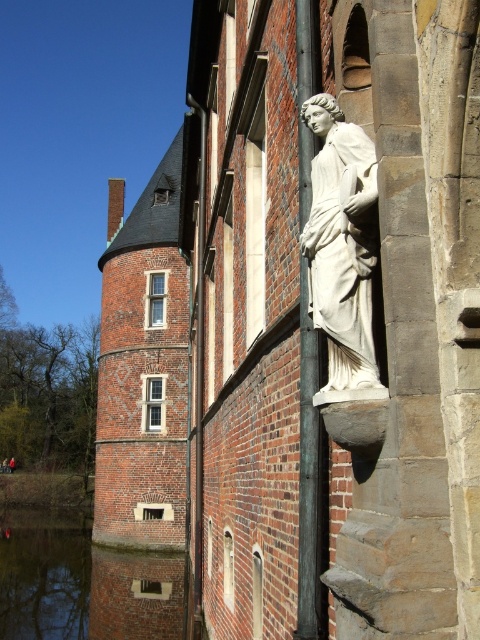
Question: Does white marble statue at upper right have a lesser width compared to smooth gray pole at center?

Choices:
 (A) yes
 (B) no

Answer: (B)

Question: Can you confirm if white marble statue at upper right is bigger than smooth gray pole at center?

Choices:
 (A) no
 (B) yes

Answer: (A)

Question: Which object is closer to the camera taking this photo?

Choices:
 (A) smooth gray pole at center
 (B) white marble statue at upper right

Answer: (B)

Question: Is white marble statue at upper right bigger than smooth gray pole at center?

Choices:
 (A) no
 (B) yes

Answer: (A)